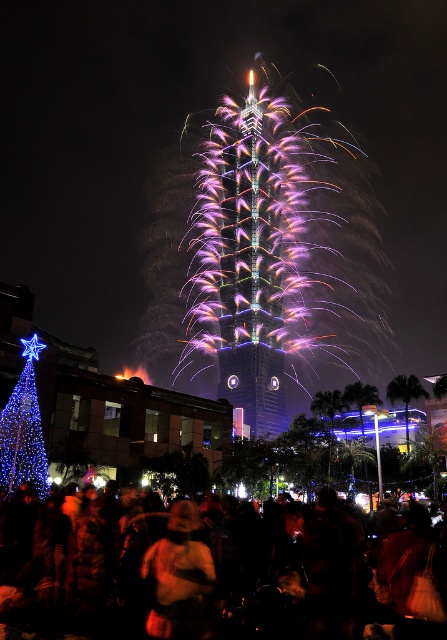
You are planning to place the matte gold helmet at center and the blue illuminated christmas tree at left on a shelf that can only hold items narrower than 20 cm. According to the description, can both items fit on the shelf?

The matte gold helmet at center might be wider than blue illuminated christmas tree at left. Since the shelf can only hold items narrower than 20 cm, it is uncertain if both can fit without exceeding the width limit. The helmet might exceed the 20 cm width, so it is safer to check the exact measurements before placing them.

You are at a festive event and see the matte gold helmet at center and the blue illuminated christmas tree at left. Which object is larger in size?

The matte gold helmet at center is bigger than the blue illuminated christmas tree at left.

You are a photographer standing at the location of the matte gold helmet at center. You want to capture a photo of the dark clothing crowd at lower center without them being too close to the foreground. Can you step back enough to do this? The minimum focusing distance of your camera is 3 meters.

The distance between the dark clothing crowd at lower center and the matte gold helmet at center is 4.25 meters. Since the camera requires a minimum focusing distance of 3 meters, stepping back would increase the distance beyond 3 meters, allowing the photographer to focus on the crowd without them being too close to the foreground.